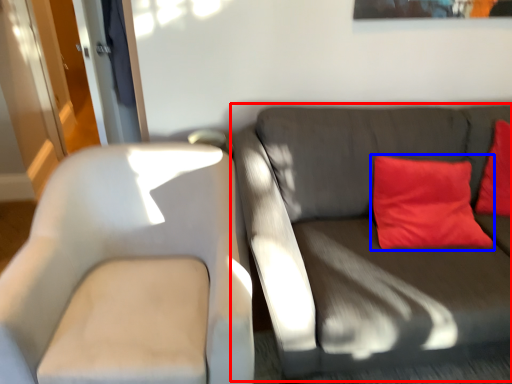
Question: Which object is closer to the camera taking this photo, studio couch (highlighted by a red box) or pillow (highlighted by a blue box)?

Choices:
 (A) studio couch
 (B) pillow

Answer: (A)